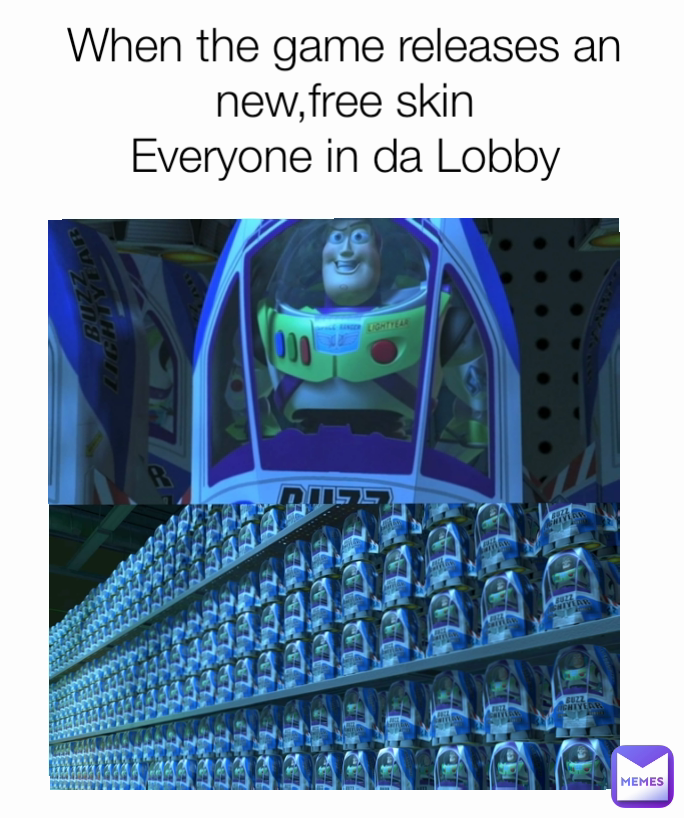
What are the coordinates of `shelves of buzz lightyear toys` in the screenshot? It's located at (282, 662), (198, 563), (248, 748).